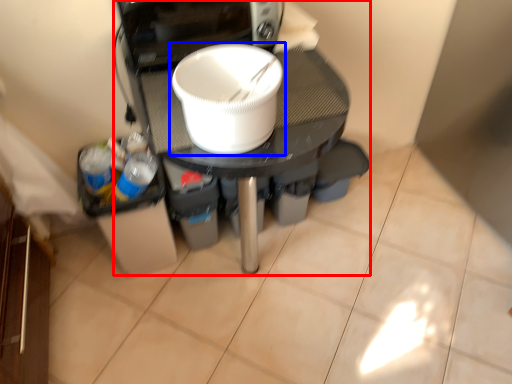
Question: Which object appears closest to the camera in this image, appliance (highlighted by a red box) or tableware (highlighted by a blue box)?

Choices:
 (A) appliance
 (B) tableware

Answer: (B)